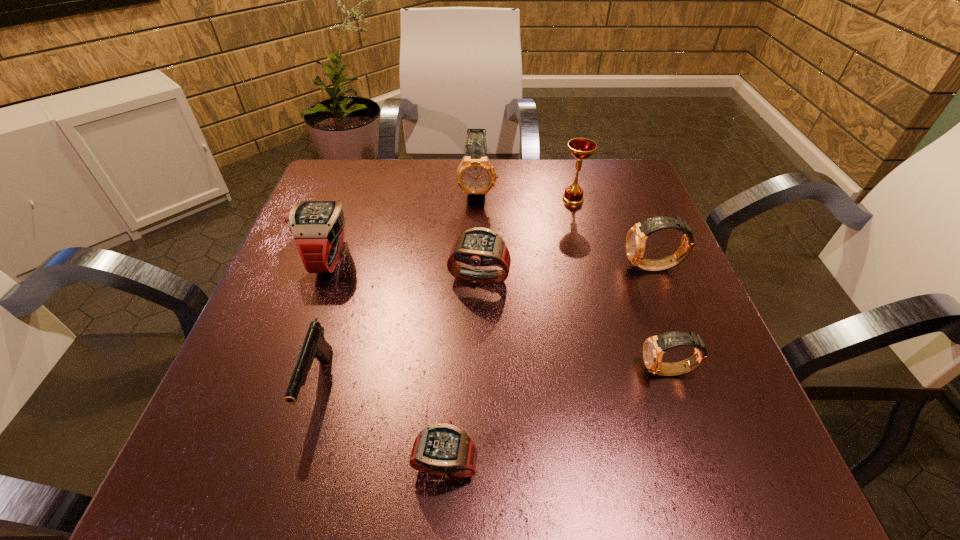
Select which watch appears as the third closest to the second biggest red watch. Please provide its 2D coordinates. Your answer should be formatted as a tuple, i.e. [(x, y)], where the tuple contains the x and y coordinates of a point satisfying the conditions above.

[(636, 237)]

Locate an element on the screen. The height and width of the screenshot is (540, 960). the third closest gold watch to the second biggest red watch is located at coordinates (654, 347).

Locate an element on the screen. This screenshot has height=540, width=960. the third closest gold watch to the shortest watch is located at coordinates (475, 176).

Select which red watch is the second closest to the biggest red watch. Please provide its 2D coordinates. Your answer should be formatted as a tuple, i.e. [(x, y)], where the tuple contains the x and y coordinates of a point satisfying the conditions above.

[(444, 449)]

Identify which red watch is the nearest to the second smallest red watch. Please provide its 2D coordinates. Your answer should be formatted as a tuple, i.e. [(x, y)], where the tuple contains the x and y coordinates of a point satisfying the conditions above.

[(317, 227)]

Identify the location of free spot that satisfies the following two spatial constraints: 1. on the face of the sixth object from left to right; 2. on the right side of the tallest watch. (477, 199).

Where is `free point that satisfies the following two spatial constraints: 1. on the back side of the chalice; 2. on the left side of the shortest watch`? The image size is (960, 540). free point that satisfies the following two spatial constraints: 1. on the back side of the chalice; 2. on the left side of the shortest watch is located at coordinates (460, 199).

The height and width of the screenshot is (540, 960). I want to click on free space that satisfies the following two spatial constraints: 1. on the face of the chalice; 2. on the left side of the tallest watch, so click(477, 199).